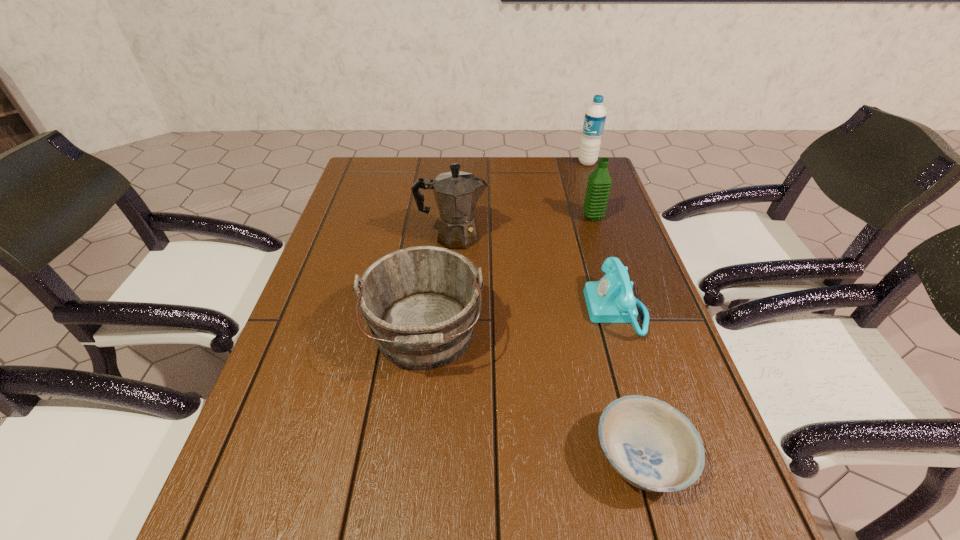
I want to click on free space located on the label of the taller water bottle, so tap(546, 163).

This screenshot has height=540, width=960. Identify the location of vacant region located 0.170m on the label of the taller water bottle. point(529,163).

Locate an element on the screen. The image size is (960, 540). vacant region located on the pouring side of the fourth nearest object is located at coordinates (570, 237).

Locate an element on the screen. This screenshot has width=960, height=540. free space located on the front of the fifth nearest object is located at coordinates (601, 245).

In order to click on vacant space located on the back of the wine bucket in this screenshot , I will do `click(439, 217)`.

Locate an element on the screen. free space located on the dial of the fifth tallest object is located at coordinates (524, 310).

Where is `free space located 0.230m on the dial of the fifth tallest object`? This screenshot has height=540, width=960. free space located 0.230m on the dial of the fifth tallest object is located at coordinates (490, 310).

Find the location of a particular element. The width and height of the screenshot is (960, 540). free space located on the dial of the fifth tallest object is located at coordinates (464, 310).

The height and width of the screenshot is (540, 960). I want to click on vacant area situated on the back of the nearest object, so click(608, 336).

The width and height of the screenshot is (960, 540). I want to click on object located in the far edge section of the desktop, so click(595, 115).